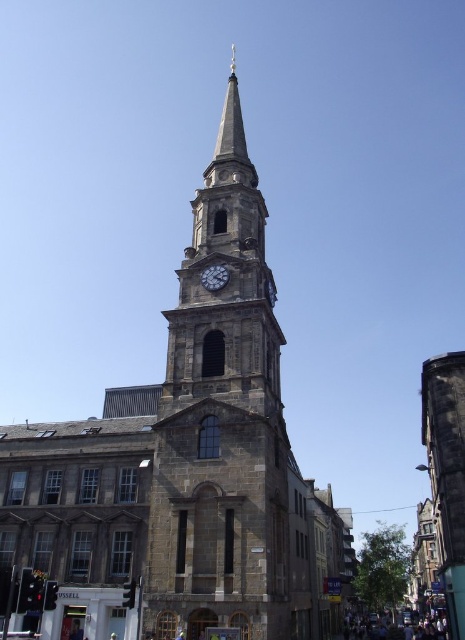
Question: Does gray stone church steeple at center appear on the right side of dark gray stone clock at upper center?

Choices:
 (A) yes
 (B) no

Answer: (A)

Question: Which point is closer to the camera?

Choices:
 (A) (239, 168)
 (B) (151, 595)

Answer: (B)

Question: Among these objects, which one is farthest from the camera?

Choices:
 (A) gray stone church steeple at center
 (B) stone clock tower at center
 (C) dark gray stone clock at upper center

Answer: (C)

Question: Where is stone clock tower at center located in relation to dark gray stone clock at upper center in the image?

Choices:
 (A) left
 (B) right

Answer: (B)

Question: Which object is the farthest from the stone clock tower at center?

Choices:
 (A) dark gray stone clock at upper center
 (B) gray stone church steeple at center

Answer: (B)

Question: Where is gray stone church steeple at center located in relation to stone clock tower at center in the image?

Choices:
 (A) above
 (B) below

Answer: (B)